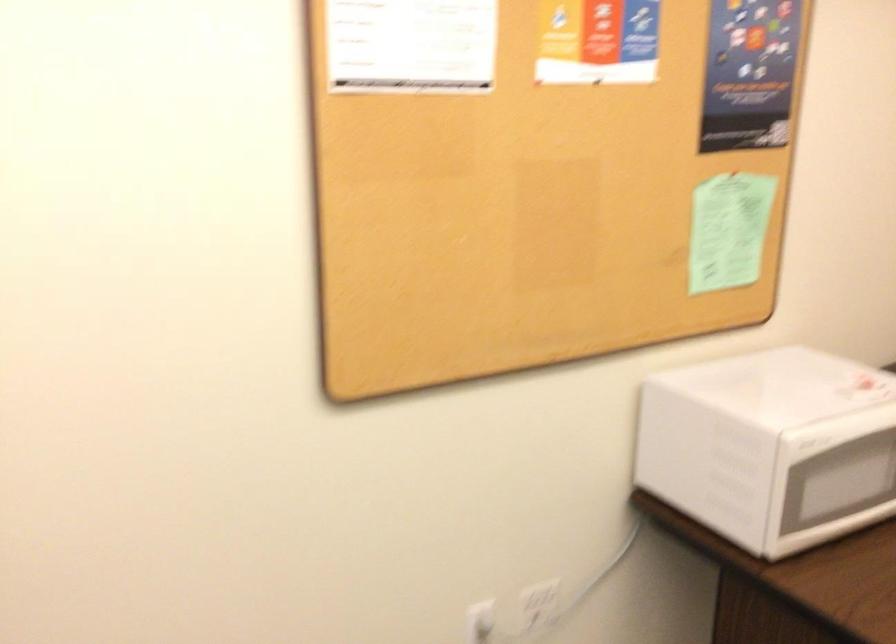
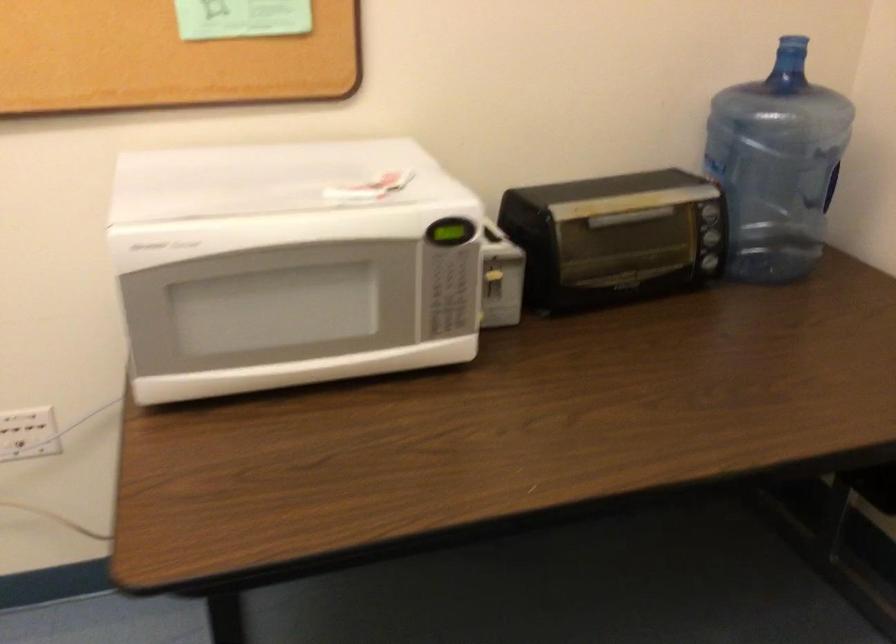
Which direction would the cameraman need to move to produce the second image?

The cameraman moved toward right, forward.